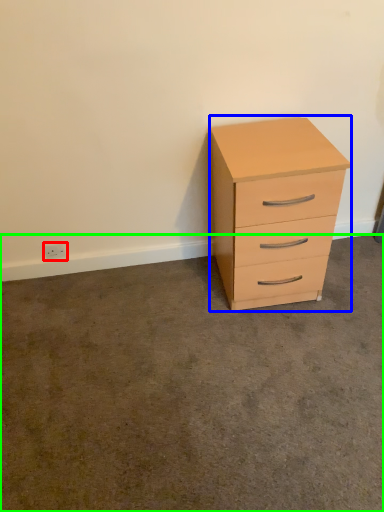
Question: Based on their relative distances, which object is nearer to electric outlet (highlighted by a red box)? Choose from chest of drawers (highlighted by a blue box) and concrete (highlighted by a green box).

Choices:
 (A) chest of drawers
 (B) concrete

Answer: (B)